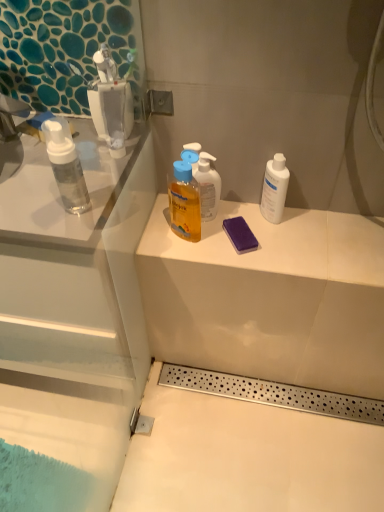
Identify the location of free spot in front of purple sponge at center. (248, 262).